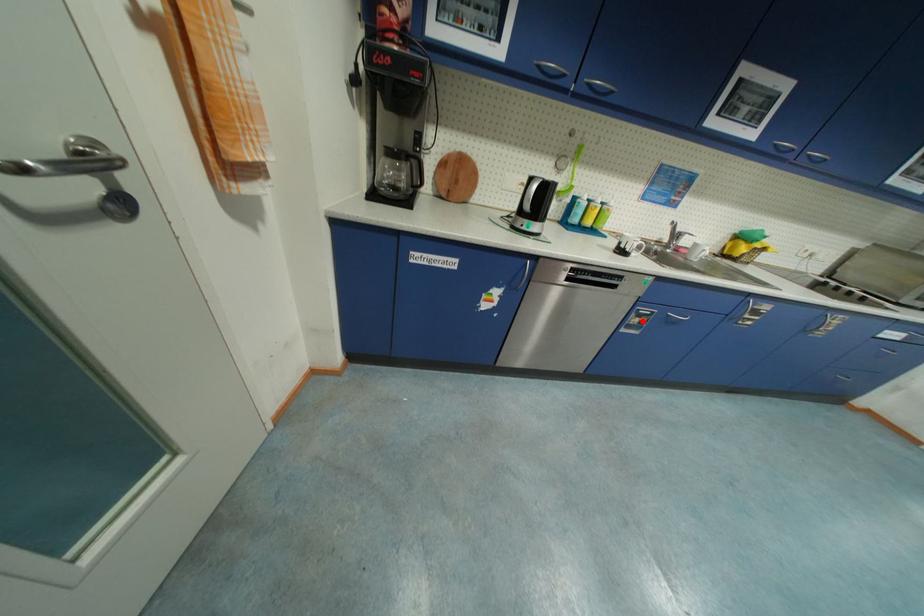
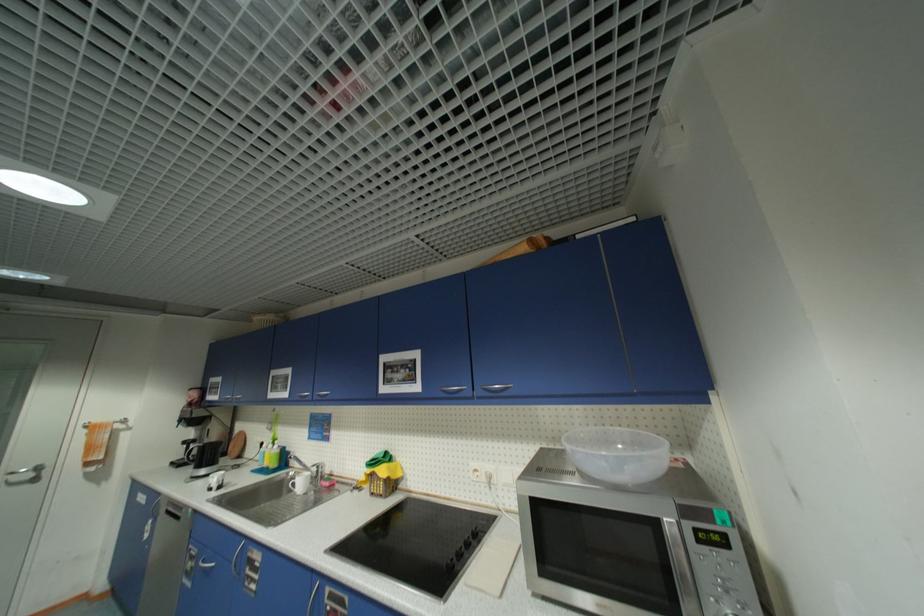
Locate, in the second image, the point that corresponds to the highlighted location in the first image.

(196, 565)